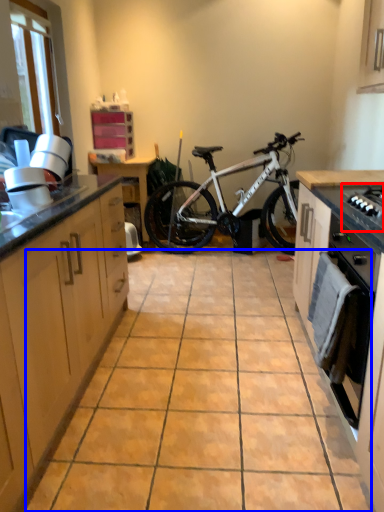
Question: Which of the following is the closest to the observer, gas stove (highlighted by a red box) or ceramic tile (highlighted by a blue box)?

Choices:
 (A) gas stove
 (B) ceramic tile

Answer: (A)